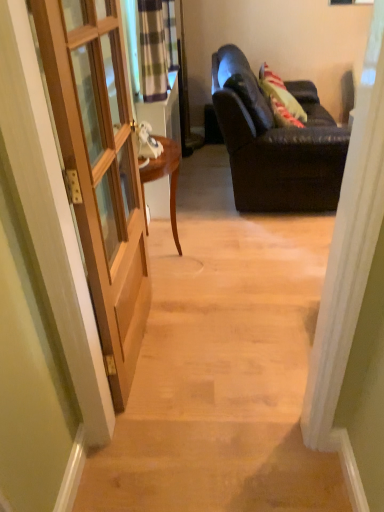
I want to click on vacant space in wooden door at left (from a real-world perspective), so click(x=141, y=357).